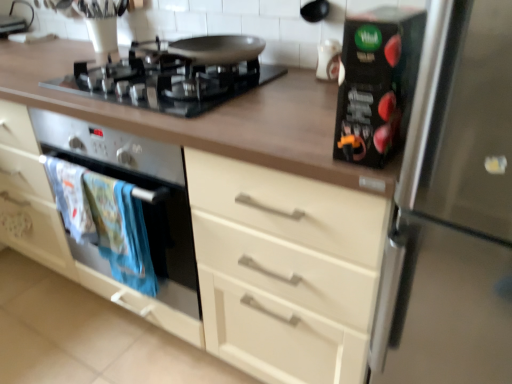
Question: Is white glossy vase at upper center, the first appliance when ordered from top to bottom, bigger or smaller than stainless steel refrigerator at right?

Choices:
 (A) small
 (B) big

Answer: (A)

Question: From their relative heights in the image, would you say white glossy vase at upper center, the first appliance when ordered from top to bottom, is taller or shorter than stainless steel refrigerator at right?

Choices:
 (A) short
 (B) tall

Answer: (A)

Question: Estimate the real-world distances between objects in this image. Which object is farther from the white glossy vase at upper center, the first appliance when ordered from back to front?

Choices:
 (A) black glossy box at upper right, the 2th appliance when ordered from back to front
 (B) matte black oven at left
 (C) black glass gas stove at upper center
 (D) white fabric towels at lower left
 (E) stainless steel refrigerator at right

Answer: (B)

Question: Which object is positioned farthest from the white glossy vase at upper center, marked as the second appliance in a bottom-to-top arrangement?

Choices:
 (A) black glass gas stove at upper center
 (B) white fabric towels at lower left
 (C) stainless steel refrigerator at right
 (D) black glossy box at upper right, placed as the 2th appliance when sorted from top to bottom
 (E) matte black oven at left

Answer: (E)